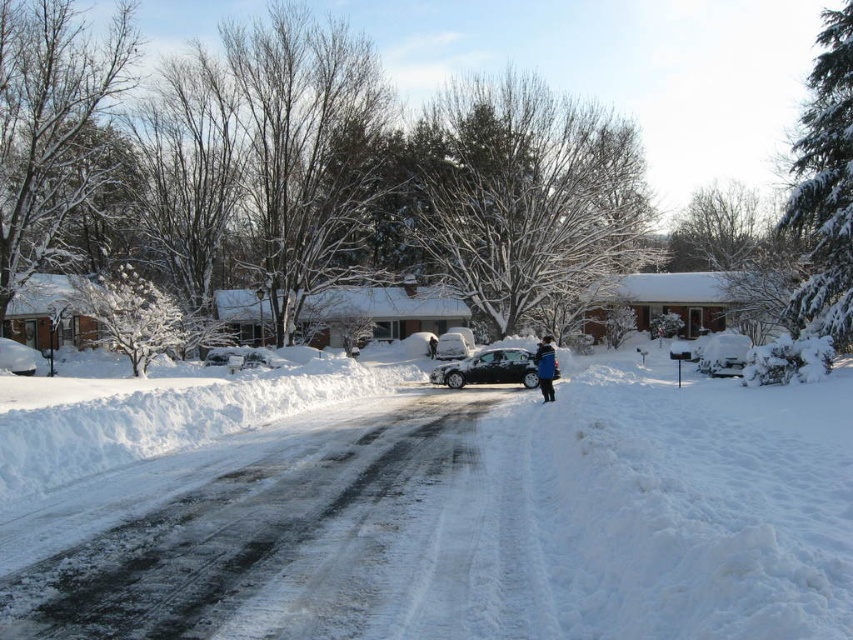
You are a delivery person trying to reach the front door of the house. You see a black matte car at center and a blue fleece jacket at center in the snowy road. Which object is closer to the front door?

The blue fleece jacket at center is closer to the front door because the black matte car at center is positioned under it, meaning the jacket is above the car and closer to the door.

You are standing at the edge of the road in the winter scene. You see the white fluffy snow at center and the blue fleece jacket at center. Which object is closer to you?

The white fluffy snow at center is closer to the viewer than the blue fleece jacket at center.

You are a delivery person trying to park your van in the residential area. The van is 6 meters long. The road has a black matte car at center and a blue fleece jacket at center. Can you park your van on the road without overlapping any objects?

The black matte car at center occupies less space than blue fleece jacket at center. Since the van is 6 meters long and the road is narrow with objects taking up space, it might not be possible to park the van without overlapping the objects. However, the exact dimensions of the road and objects are not provided, so it is uncertain.